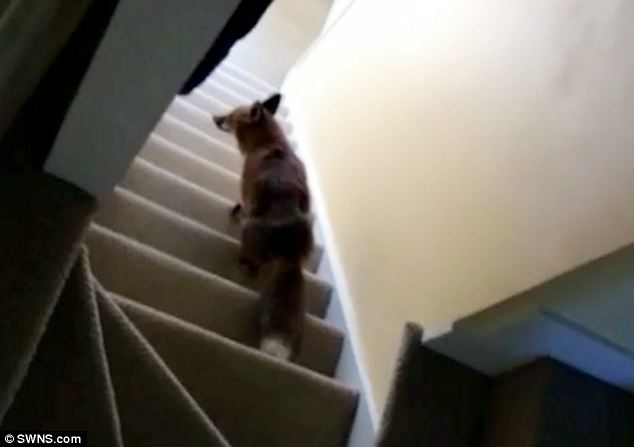
Image resolution: width=634 pixels, height=447 pixels. In order to click on carpet in this screenshot , I will do `click(33, 252)`.